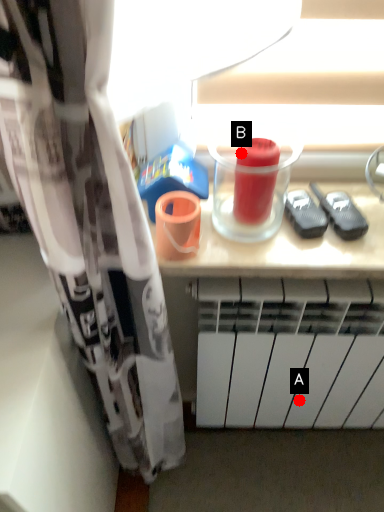
Question: Two points are circled on the image, labeled by A and B beside each circle. Which point appears closest to the camera in this image?

Choices:
 (A) A is closer
 (B) B is closer

Answer: (B)